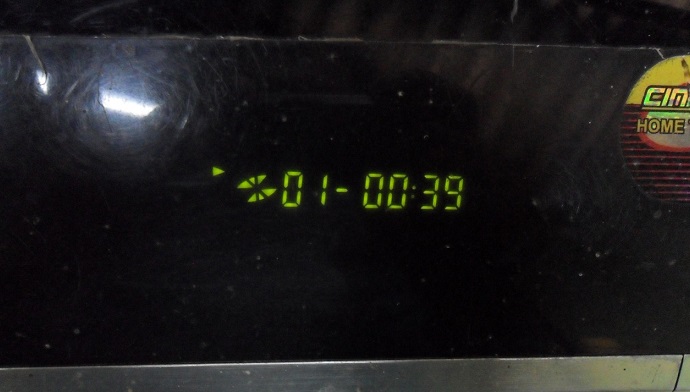
Identify the location of "home". This screenshot has width=690, height=392. (662, 127).